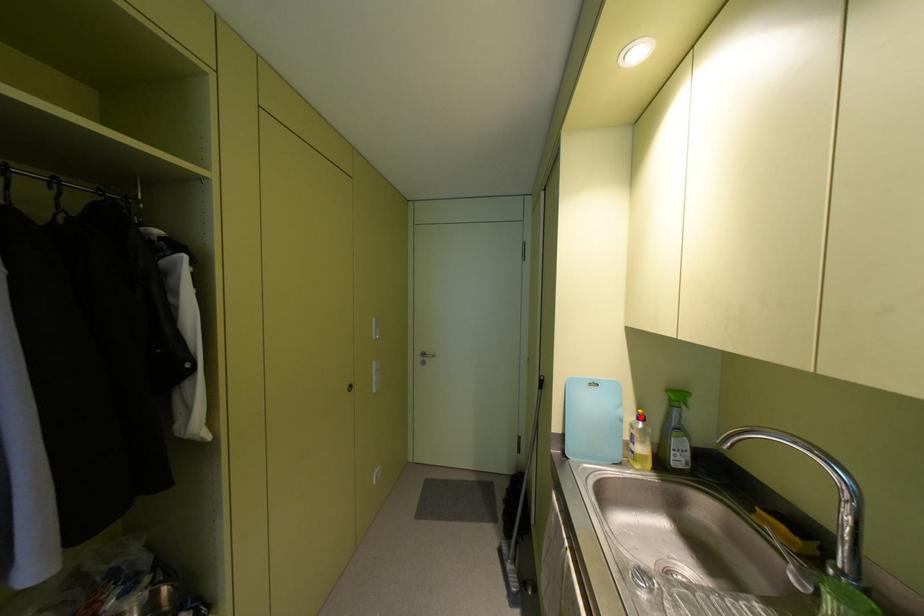
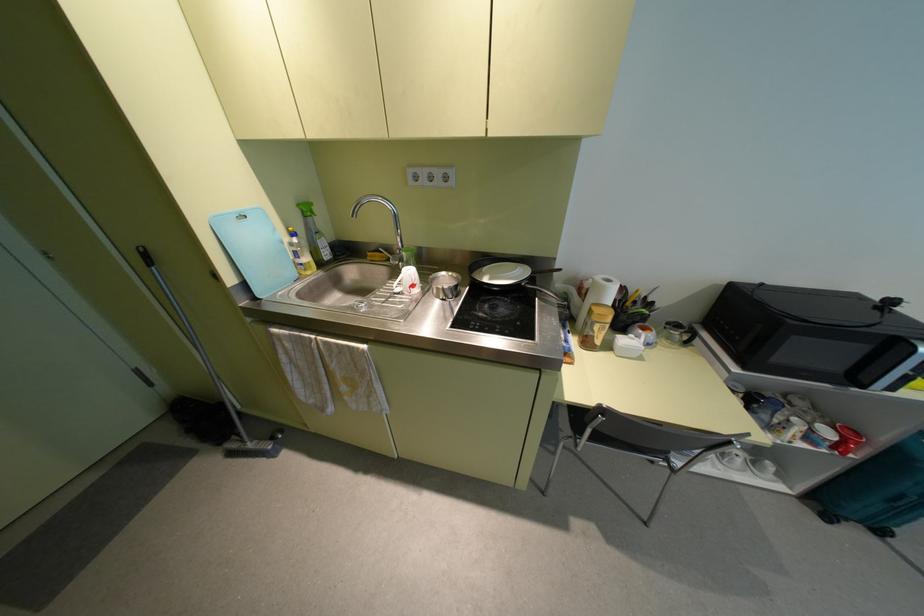
Locate, in the second image, the point that corresponds to the highlighted location in the first image.

(293, 233)